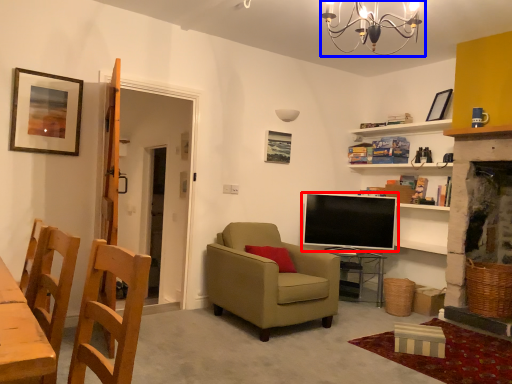
Question: Among these objects, which one is nearest to the camera, television (highlighted by a red box) or light fixture (highlighted by a blue box)?

Choices:
 (A) television
 (B) light fixture

Answer: (B)